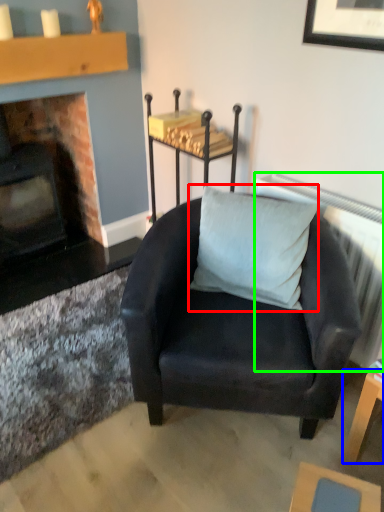
Question: Which is farther away from pillow (highlighted by a red box)? table (highlighted by a blue box) or radiator (highlighted by a green box)?

Choices:
 (A) table
 (B) radiator

Answer: (A)